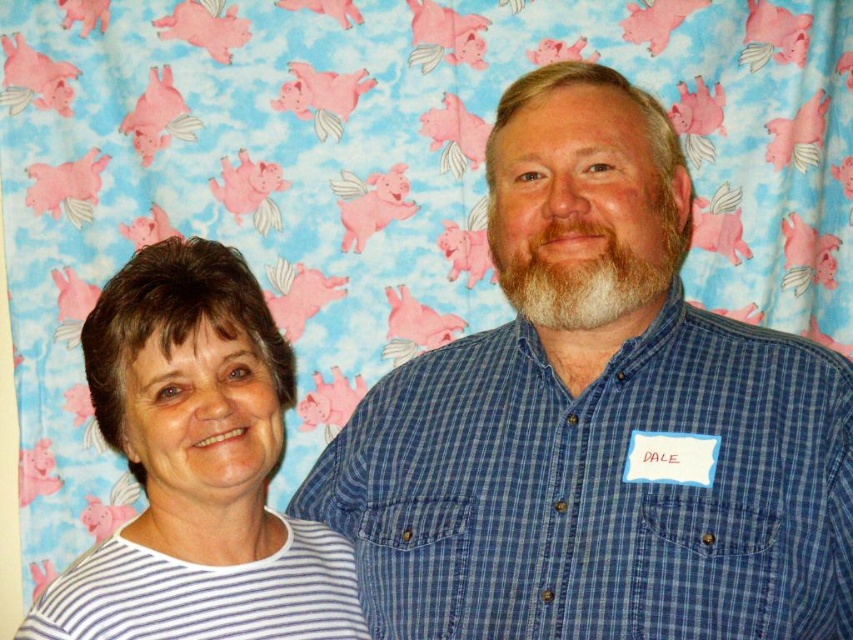
Question: Does blue checkered shirt at center have a lesser width compared to white striped shirt at left?

Choices:
 (A) no
 (B) yes

Answer: (A)

Question: Is blue checkered shirt at center positioned before white striped shirt at left?

Choices:
 (A) yes
 (B) no

Answer: (A)

Question: Which point appears farthest from the camera in this image?

Choices:
 (A) (656, 308)
 (B) (300, 605)

Answer: (B)

Question: Does blue checkered shirt at center have a greater width compared to white striped shirt at left?

Choices:
 (A) no
 (B) yes

Answer: (B)

Question: Among these objects, which one is nearest to the camera?

Choices:
 (A) blue checkered shirt at center
 (B) white striped shirt at left

Answer: (A)

Question: Which object appears farthest from the camera in this image?

Choices:
 (A) blue checkered shirt at center
 (B) white striped shirt at left

Answer: (B)